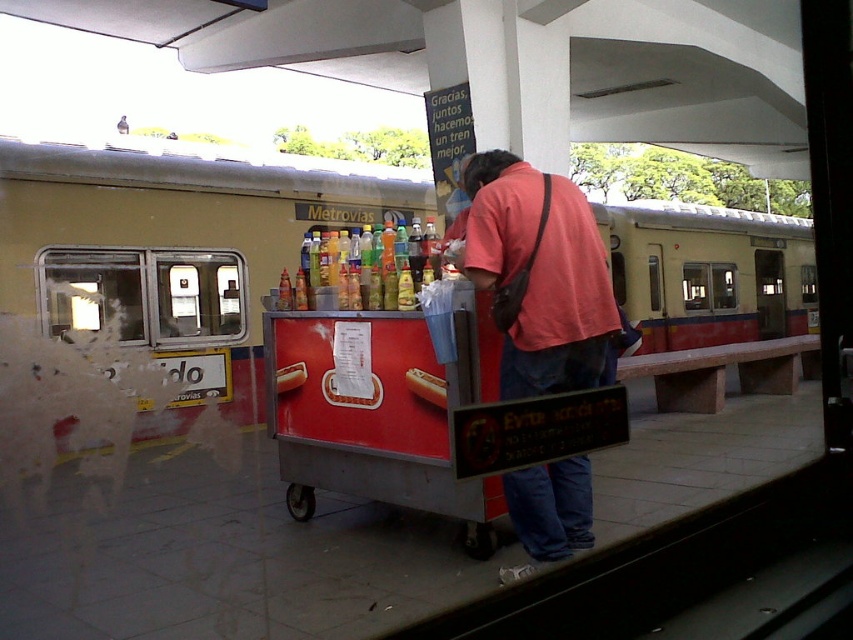
Question: Which of these objects is positioned closest to the smooth white hot dog at center?

Choices:
 (A) matte pink shirt at center
 (B) translucent plastic bottles at center

Answer: (B)

Question: Which of the following is the farthest from the observer?

Choices:
 (A) matte plastic hot dog at center
 (B) smooth white hot dog at center
 (C) translucent plastic bottles at center

Answer: (B)

Question: In this image, where is matte pink shirt at center located relative to translucent plastic bottles at center?

Choices:
 (A) below
 (B) above

Answer: (B)

Question: Which point appears farthest from the camera in this image?

Choices:
 (A) (281, 374)
 (B) (410, 372)

Answer: (A)

Question: From the image, what is the correct spatial relationship of matte pink shirt at center in relation to smooth white hot dog at center?

Choices:
 (A) above
 (B) below

Answer: (A)

Question: Observing the image, what is the correct spatial positioning of matte pink shirt at center in reference to smooth white hot dog at center?

Choices:
 (A) right
 (B) left

Answer: (A)